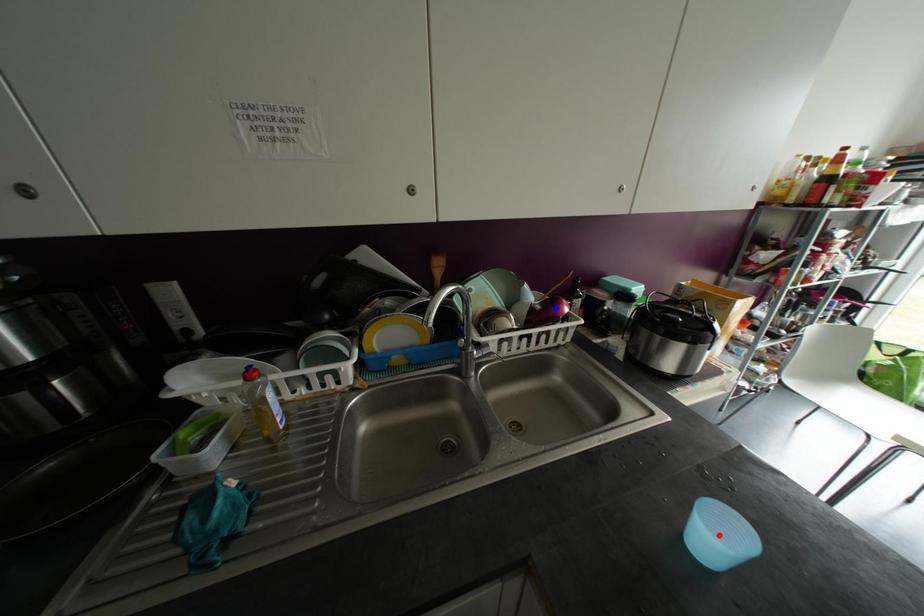
Question: In the image, two points are highlighted. Which point is nearer to the camera? Reply with the corresponding letter.

Choices:
 (A) blue point
 (B) red point

Answer: (B)